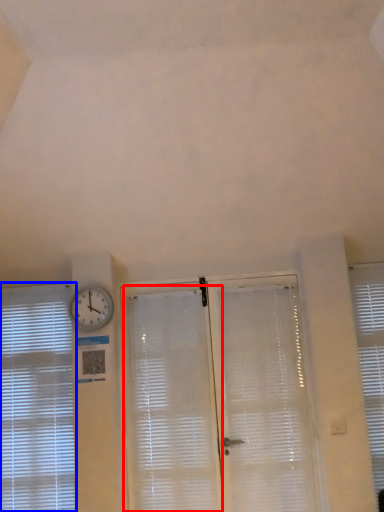
Question: Which object appears farthest to the camera in this image, shutter (highlighted by a red box) or window blind (highlighted by a blue box)?

Choices:
 (A) shutter
 (B) window blind

Answer: (B)